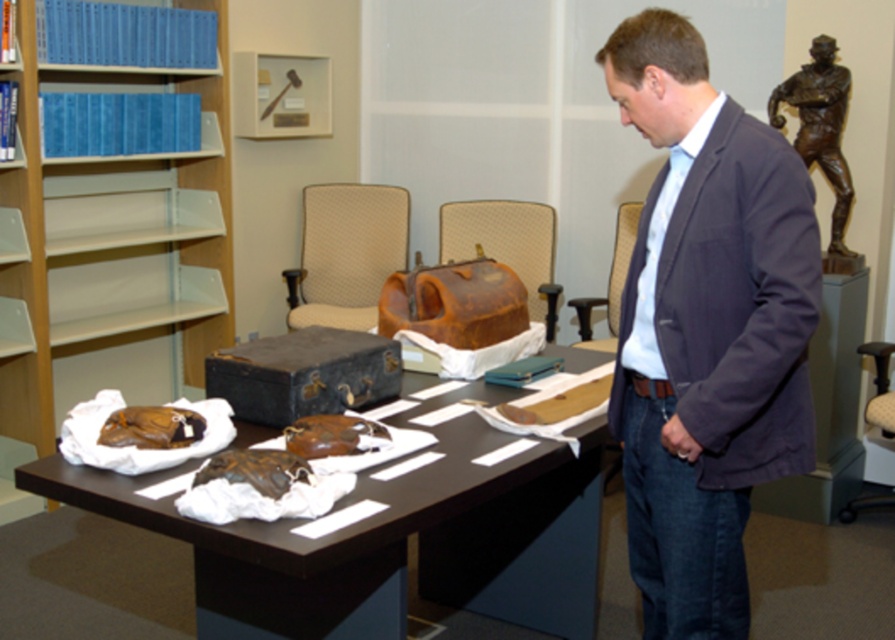
Question: Based on their relative distances, which object is farther from the dark gray blazer at center?

Choices:
 (A) brown leather gloves at center
 (B) blue plastic bookshelf at left
 (C) bronze statue at upper right

Answer: (B)

Question: Does dark gray blazer at center appear under brown leather gloves at center?

Choices:
 (A) no
 (B) yes

Answer: (A)

Question: Which object is positioned closest to the dark gray blazer at center?

Choices:
 (A) bronze statue at upper right
 (B) brown leather gloves at center

Answer: (B)

Question: Estimate the real-world distances between objects in this image. Which object is closer to the bronze statue at upper right?

Choices:
 (A) dark gray blazer at center
 (B) brown leather gloves at center
 (C) blue plastic bookshelf at left

Answer: (A)

Question: Does blue plastic bookshelf at left appear under brown leather gloves at center?

Choices:
 (A) no
 (B) yes

Answer: (A)

Question: Is dark gray blazer at center smaller than blue plastic bookshelf at left?

Choices:
 (A) yes
 (B) no

Answer: (A)